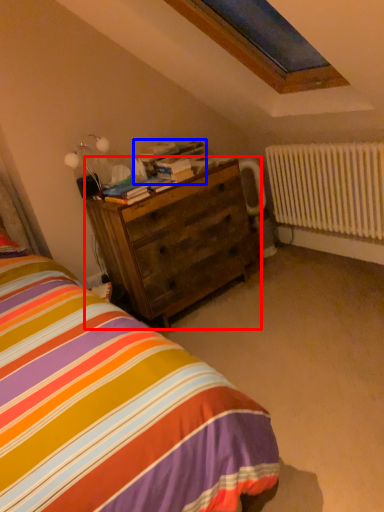
Question: Among these objects, which one is nearest to the camera, chest of drawers (highlighted by a red box) or book (highlighted by a blue box)?

Choices:
 (A) chest of drawers
 (B) book

Answer: (A)